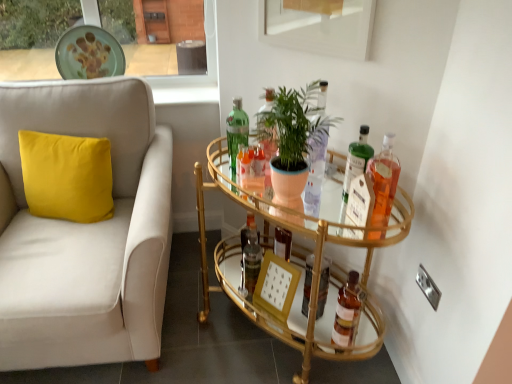
Question: From a real-world perspective, is wooden picture frame at center beneath translucent glass bottle at upper right, which is counted as the 3th bottle, starting from the right?

Choices:
 (A) no
 (B) yes

Answer: (B)

Question: Could you tell me if wooden picture frame at center is facing translucent glass bottle at upper right, the third bottle when ordered from left to right?

Choices:
 (A) yes
 (B) no

Answer: (B)

Question: Can you confirm if wooden picture frame at center is thinner than translucent glass bottle at upper right, the third bottle when ordered from left to right?

Choices:
 (A) no
 (B) yes

Answer: (A)

Question: Would you say wooden picture frame at center is a long distance from translucent glass bottle at upper right, which is counted as the 3th bottle, starting from the right?

Choices:
 (A) yes
 (B) no

Answer: (B)

Question: Considering the relative positions of wooden picture frame at center and translucent glass bottle at upper right, which is counted as the 3th bottle, starting from the right, in the image provided, is wooden picture frame at center in front of translucent glass bottle at upper right, which is counted as the 3th bottle, starting from the right,?

Choices:
 (A) yes
 (B) no

Answer: (B)

Question: Which is correct: white fabric couch at left is inside brown glass bottle at lower right, placed as the 2th bottle when sorted from right to left, or outside of it?

Choices:
 (A) outside
 (B) inside

Answer: (A)

Question: Looking at their shapes, would you say white fabric couch at left is wider or thinner than brown glass bottle at lower right, which is counted as the 4th bottle, starting from the left?

Choices:
 (A) thin
 (B) wide

Answer: (B)

Question: From a real-world perspective, is white fabric couch at left above or below brown glass bottle at lower right, which is counted as the 4th bottle, starting from the left?

Choices:
 (A) above
 (B) below

Answer: (A)

Question: Is white fabric couch at left taller or shorter than brown glass bottle at lower right, which is counted as the 4th bottle, starting from the left?

Choices:
 (A) short
 (B) tall

Answer: (B)

Question: Visually, is green matte plate at upper center positioned to the left or to the right of green matte plant at center?

Choices:
 (A) right
 (B) left

Answer: (B)

Question: Is point (104, 69) closer or farther from the camera than point (265, 120)?

Choices:
 (A) farther
 (B) closer

Answer: (A)

Question: Is green matte plate at upper center bigger or smaller than green matte plant at center?

Choices:
 (A) small
 (B) big

Answer: (A)

Question: Is green matte plate at upper center taller or shorter than green matte plant at center?

Choices:
 (A) short
 (B) tall

Answer: (A)

Question: Is point (294, 107) closer or farther from the camera than point (258, 205)?

Choices:
 (A) farther
 (B) closer

Answer: (B)

Question: Do you think green matte plant at center is within gold glass bar cart at center, or outside of it?

Choices:
 (A) inside
 (B) outside

Answer: (B)